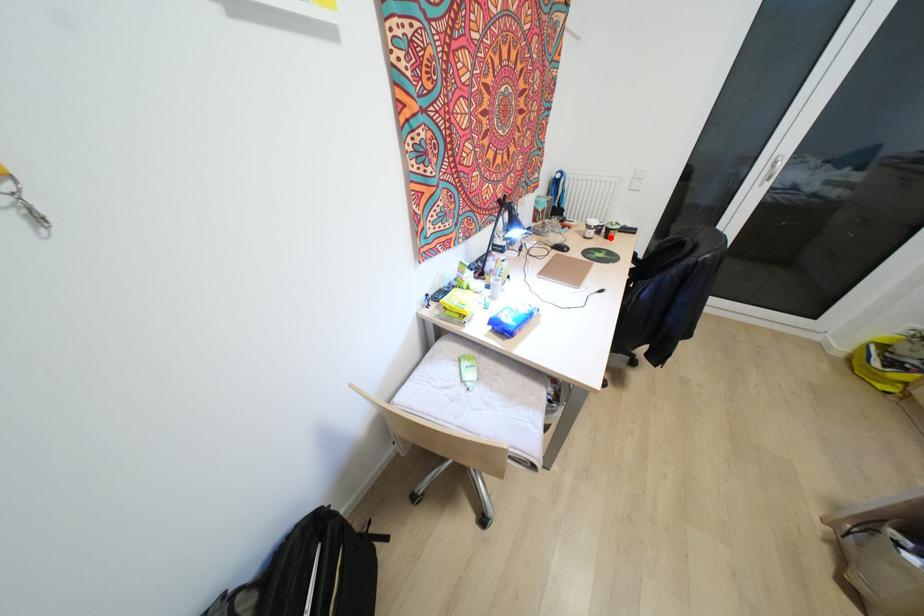
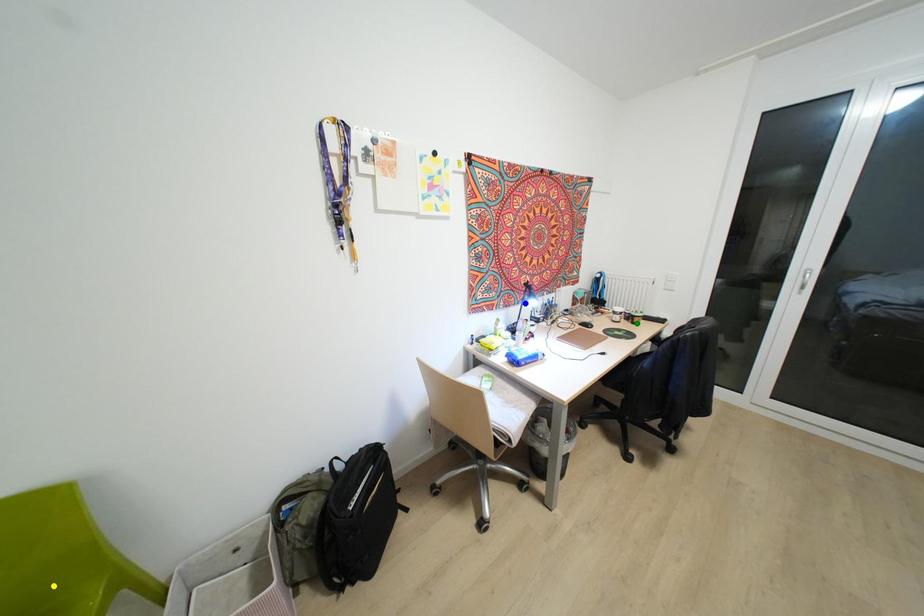
Question: I am providing you with two images of the same scene from different viewpoints. A red point is marked on the first image. You are given multiple points on the second image. Which spot in image 2 lines up with the point in image 1?

Choices:
 (A) blue point
 (B) yellow point
 (C) green point

Answer: (C)